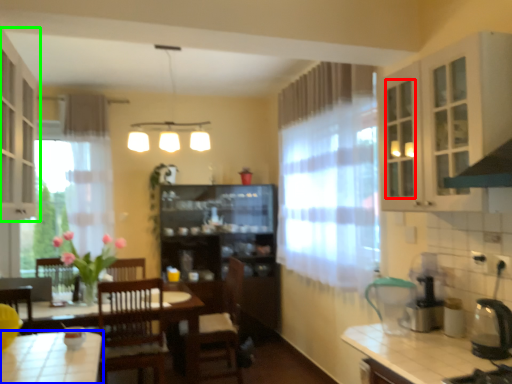
Question: Which is farther away from glass door (highlighted by a red box)? kitchen & dining room table (highlighted by a blue box) or cabinetry (highlighted by a green box)?

Choices:
 (A) kitchen & dining room table
 (B) cabinetry

Answer: (A)